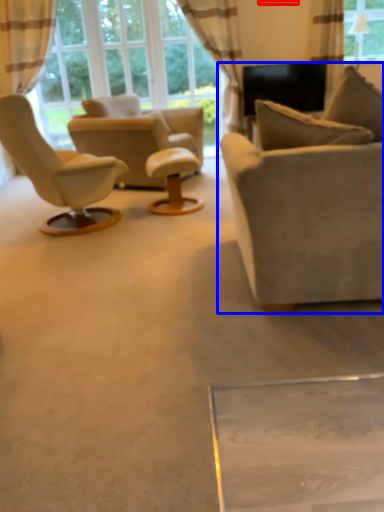
Question: Which point is closer to the camera, picture frame (highlighted by a red box) or studio couch (highlighted by a blue box)?

Choices:
 (A) picture frame
 (B) studio couch

Answer: (B)